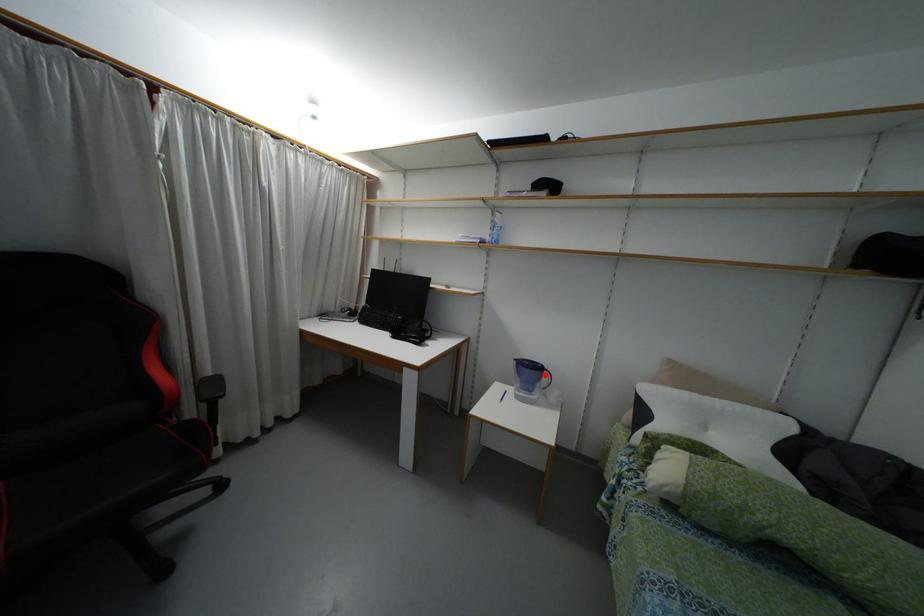
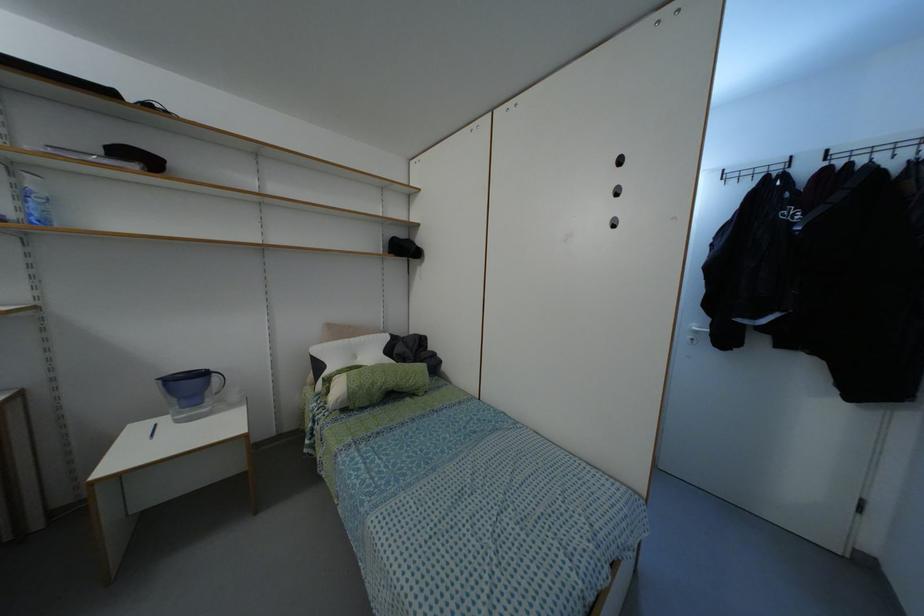
Locate, in the second image, the point that corresponds to the highlighted location in the first image.

(214, 378)